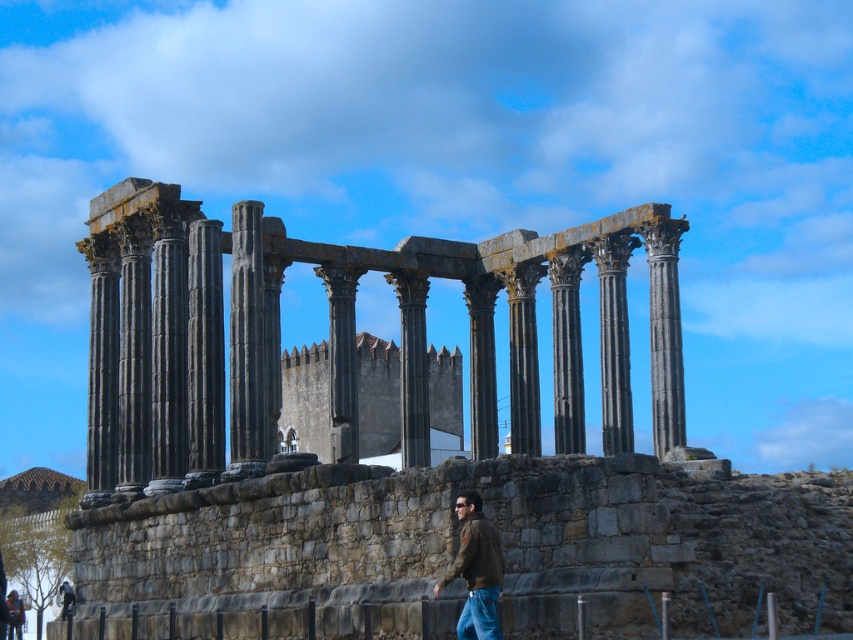
Between dark gray stone columns at center and brown leather jacket at lower right, which one appears on the right side from the viewer's perspective?

brown leather jacket at lower right is more to the right.

Measure the distance between dark gray stone columns at center and brown leather jacket at lower right.

dark gray stone columns at center is 86.62 feet away from brown leather jacket at lower right.

Is point (514, 394) closer to camera compared to point (476, 540)?

No.

What are the coordinates of `dark gray stone columns at center` in the screenshot? It's located at (341, 337).

Which is more to the right, dark gray stone column at center or black stone column at center?

black stone column at center is more to the right.

Who is positioned more to the left, dark gray stone column at center or black stone column at center?

dark gray stone column at center

At what (x,y) coordinates should I click in order to perform the action: click on dark gray stone column at center. Please return your answer as a coordinate pair (x, y). The image size is (853, 640). Looking at the image, I should click on (247, 342).

Does dark gray stone column at center appear over brown leather jacket at lower right?

Correct, dark gray stone column at center is located above brown leather jacket at lower right.

Image resolution: width=853 pixels, height=640 pixels. What do you see at coordinates (247, 342) in the screenshot?
I see `dark gray stone column at center` at bounding box center [247, 342].

Is point (260, 289) positioned before point (483, 538)?

That is False.

This screenshot has height=640, width=853. I want to click on dark gray stone column at center, so click(247, 342).